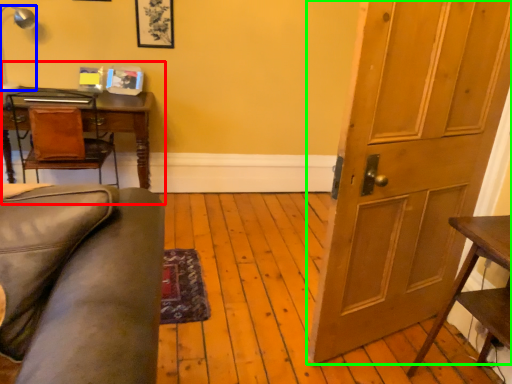
Question: Which object is positioned farthest from computer desk (highlighted by a red box)? Select from lamp (highlighted by a blue box) and door (highlighted by a green box).

Choices:
 (A) lamp
 (B) door

Answer: (B)